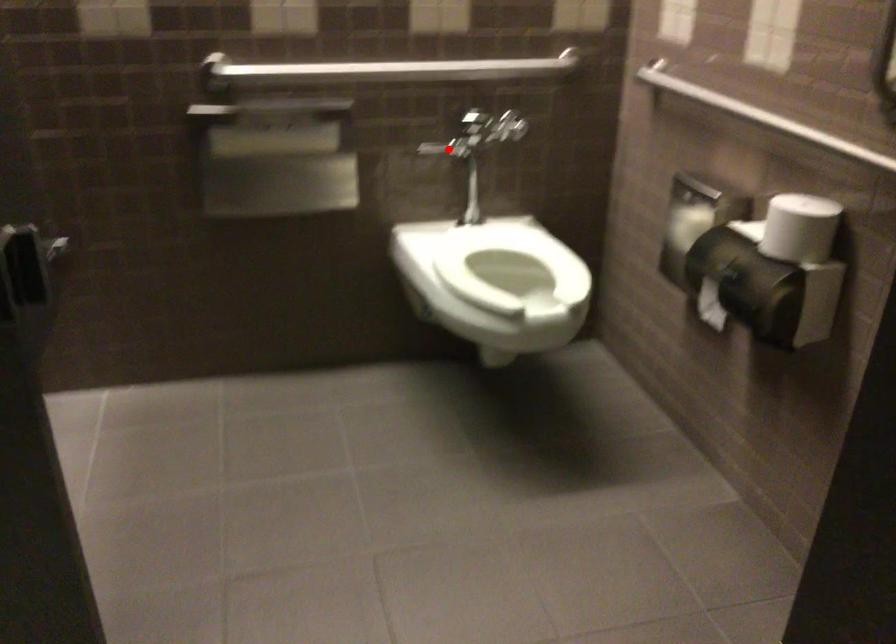
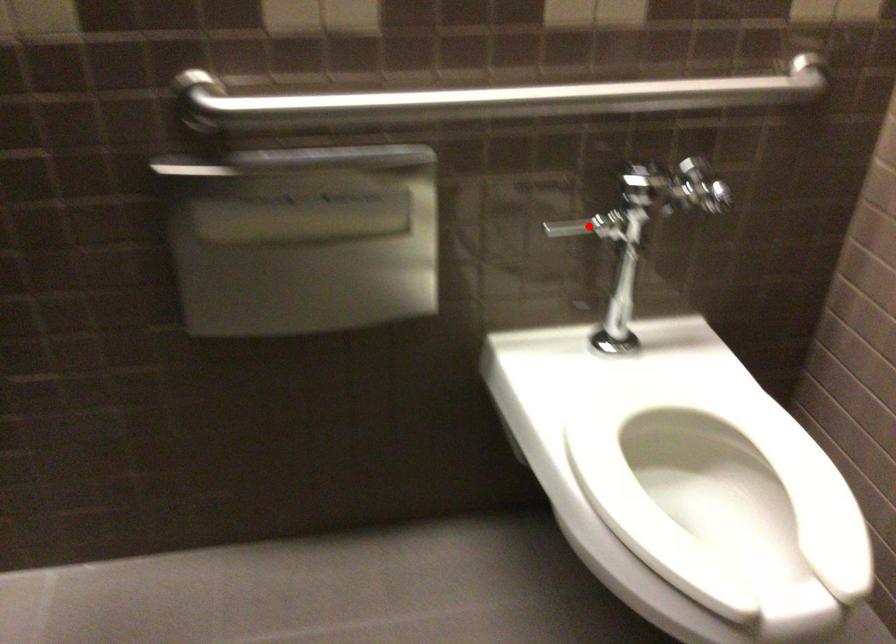
I am providing you with two images of the same scene from different viewpoints. A red point is marked on the first image and another point is marked on the second image. Is the red point in image1 aligned with the point shown in image2?

Yes